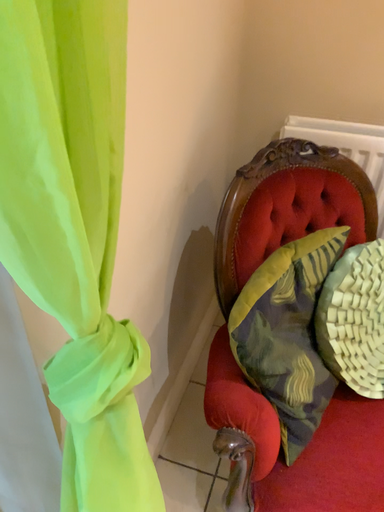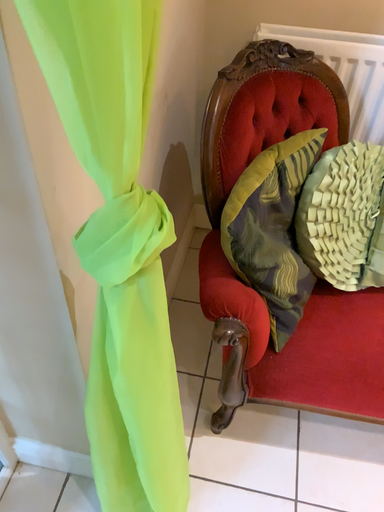
Question: How did the camera likely rotate when shooting the video?

Choices:
 (A) rotated upward
 (B) rotated downward

Answer: (B)